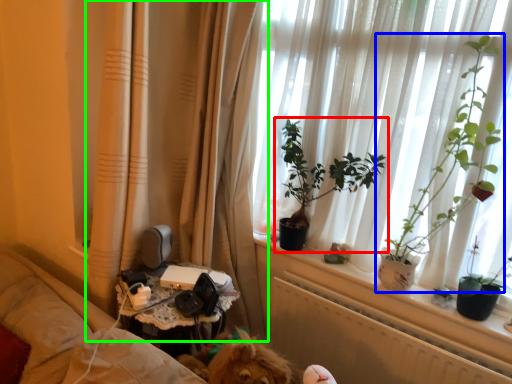
Question: Which object is positioned farthest from houseplant (highlighted by a red box)? Select from houseplant (highlighted by a blue box) and curtain (highlighted by a green box).

Choices:
 (A) houseplant
 (B) curtain

Answer: (A)